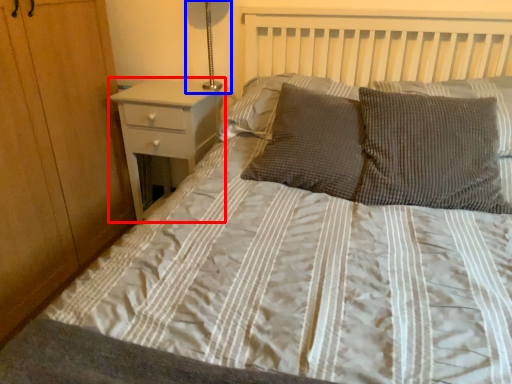
Question: Which object is closer to the camera taking this photo, nightstand (highlighted by a red box) or bedside lamp (highlighted by a blue box)?

Choices:
 (A) nightstand
 (B) bedside lamp

Answer: (B)